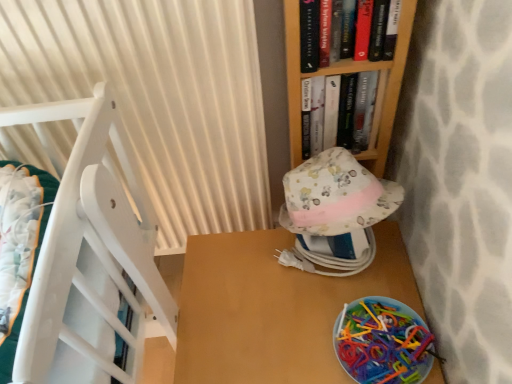
In order to click on free space that is to the left of floral fabric hat at center in this screenshot , I will do `click(244, 274)`.